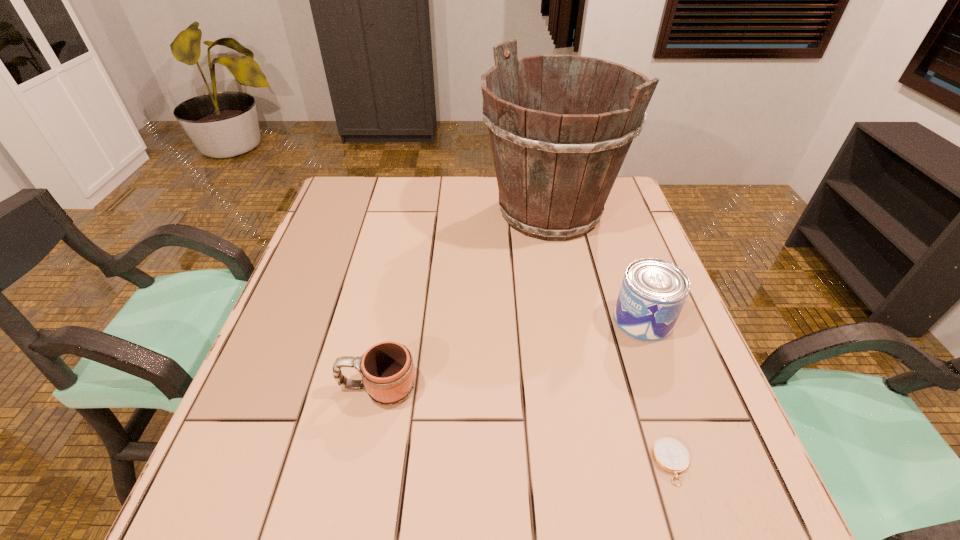
This screenshot has height=540, width=960. Find the location of `the tallest object`. the tallest object is located at coordinates (555, 171).

You are a GUI agent. You are given a task and a screenshot of the screen. Output one action in this format:
    pyautogui.click(x=<x>, y=<y>)
    Task: Click on the farthest object
    This screenshot has height=540, width=960.
    Given the screenshot: What is the action you would take?
    pyautogui.click(x=555, y=171)

You are a GUI agent. You are given a task and a screenshot of the screen. Output one action in this format:
    pyautogui.click(x=<x>, y=<y>)
    Task: Click on the second tallest object
    The image size is (960, 540).
    Given the screenshot: What is the action you would take?
    pyautogui.click(x=653, y=292)

You are a GUI agent. You are given a task and a screenshot of the screen. Output one action in this format:
    pyautogui.click(x=<x>, y=<y>)
    Task: Click on the can
    This screenshot has width=960, height=540.
    Given the screenshot: What is the action you would take?
    pyautogui.click(x=653, y=292)

This screenshot has height=540, width=960. What are the coordinates of `the leftmost object` in the screenshot? It's located at (388, 375).

Find the location of a particular element. Image resolution: width=960 pixels, height=540 pixels. mug is located at coordinates (388, 375).

Locate an element on the screen. the shortest object is located at coordinates (669, 454).

Locate an element on the screen. Image resolution: width=960 pixels, height=540 pixels. the nearest object is located at coordinates (669, 454).

At what (x,y) coordinates should I click in order to perform the action: click on vacant area situated on the front of the tallest object. Please return your answer as a coordinate pair (x, y). The width and height of the screenshot is (960, 540). Looking at the image, I should click on (568, 306).

Identify the location of vacant space located on the front label of the third shortest object. The height and width of the screenshot is (540, 960). (583, 320).